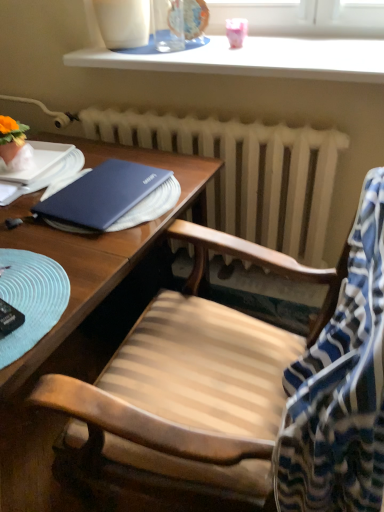
Find the location of a particular element. This screenshot has height=512, width=384. wooden chair at center is located at coordinates (246, 394).

Locate an element on the screen. The image size is (384, 512). white matte radiator at center is located at coordinates (245, 173).

Where is `matte blue notebook at center`? The width and height of the screenshot is (384, 512). matte blue notebook at center is located at coordinates (112, 197).

What do you see at coordinates (83, 318) in the screenshot? The height and width of the screenshot is (512, 384). I see `wooden desk at center` at bounding box center [83, 318].

Image resolution: width=384 pixels, height=512 pixels. Identify the location of wooden chair at center. tap(246, 394).

Which object is further away from the camera taking this photo, wooden desk at center or blue striped fabric at right?

wooden desk at center is further away from the camera.

Is wooden desk at center outside of blue striped fabric at right?

wooden desk at center lies outside blue striped fabric at right's area.

Considering the relative sizes of wooden desk at center and blue striped fabric at right in the image provided, is wooden desk at center shorter than blue striped fabric at right?

No, wooden desk at center is not shorter than blue striped fabric at right.

From a real-world perspective, which is physically below, wooden desk at center or blue striped fabric at right?

From a 3D spatial view, wooden desk at center is below.

Considering the sizes of white glossy window sill at upper center and wooden desk at center in the image, is white glossy window sill at upper center wider or thinner than wooden desk at center?

Considering their sizes, white glossy window sill at upper center looks slimmer than wooden desk at center.

This screenshot has height=512, width=384. Find the location of `window sill that appears above the wooden desk at center (from the image's perspective)`. window sill that appears above the wooden desk at center (from the image's perspective) is located at coordinates (255, 58).

Is white glossy window sill at upper center located outside wooden desk at center?

Yes.

Which object is closer to the camera taking this photo, white glossy window sill at upper center or wooden desk at center?

wooden desk at center is more forward.

From the image's perspective, is wooden chair at center above or below matte blue notebook at center?

Based on their image positions, wooden chair at center is located beneath matte blue notebook at center.

Between point (183, 335) and point (86, 218), which one is positioned behind?

The point (183, 335) is farther.

Considering the relative sizes of wooden chair at center and matte blue notebook at center in the image provided, is wooden chair at center shorter than matte blue notebook at center?

In fact, wooden chair at center may be taller than matte blue notebook at center.

In the scene shown: Is wooden chair at center behind matte blue notebook at center?

No, it is in front of matte blue notebook at center.

Are white matte radiator at center and wooden desk at center located far from each other?

No.

Consider the image. Based on their sizes in the image, would you say white matte radiator at center is bigger or smaller than wooden desk at center?

white matte radiator at center is smaller than wooden desk at center.

Which object is wider, white matte radiator at center or wooden desk at center?

wooden desk at center is wider.

From a real-world perspective, is white matte radiator at center physically located above or below wooden desk at center?

Clearly, from a real-world perspective, white matte radiator at center is above wooden desk at center.

Is matte blue notebook at center at the right side of white matte radiator at center?

Incorrect, matte blue notebook at center is not on the right side of white matte radiator at center.

Is matte blue notebook at center in contact with white matte radiator at center?

No, matte blue notebook at center is not next to white matte radiator at center.

From a real-world perspective, is wooden desk at center physically located above or below matte blue notebook at center?

From a real-world perspective, wooden desk at center is physically below matte blue notebook at center.

Which of these two, wooden desk at center or matte blue notebook at center, is smaller?

matte blue notebook at center.

Is point (167, 160) farther from viewer compared to point (175, 186)?

Yes.

Between wooden desk at center and matte blue notebook at center, which one is positioned behind?

Positioned behind is matte blue notebook at center.

Is white matte radiator at center wider than white glossy window sill at upper center?

No.

Consider the image. Are white matte radiator at center and white glossy window sill at upper center making contact?

No, white matte radiator at center is not touching white glossy window sill at upper center.

Is point (130, 112) closer to viewer compared to point (313, 44)?

No, it is behind (313, 44).

At what (x,y) coordinates should I click in order to perform the action: click on blanket below the wooden desk at center (from the image's perspective). Please return your answer as a coordinate pair (x, y). This screenshot has height=512, width=384. Looking at the image, I should click on (340, 387).

Find the location of `desk below the white glossy window sill at upper center (from a real-world perspective)`. desk below the white glossy window sill at upper center (from a real-world perspective) is located at coordinates (83, 318).

Estimate the real-world distances between objects in this image. Which object is further from white matte radiator at center, wooden chair at center or white glossy window sill at upper center?

Based on the image, wooden chair at center appears to be further to white matte radiator at center.

When comparing their distances from wooden desk at center, does wooden chair at center or white glossy window sill at upper center seem closer?

The object closer to wooden desk at center is wooden chair at center.

Estimate the real-world distances between objects in this image. Which object is further from white matte radiator at center, white glossy window sill at upper center or blue striped fabric at right?

blue striped fabric at right lies further to white matte radiator at center than the other object.

From the image, which object appears to be farther from wooden desk at center, white matte radiator at center or matte blue notebook at center?

The object further to wooden desk at center is white matte radiator at center.

Based on their spatial positions, is white matte radiator at center or wooden chair at center further from blue striped fabric at right?

white matte radiator at center is further to blue striped fabric at right.

Estimate the real-world distances between objects in this image. Which object is closer to white matte radiator at center, blue striped fabric at right or wooden desk at center?

wooden desk at center.

Looking at this image, based on their spatial positions, is wooden chair at center or wooden desk at center closer to white matte radiator at center?

wooden desk at center.

Based on their spatial positions, is wooden desk at center or wooden chair at center closer to blue striped fabric at right?

Based on the image, wooden chair at center appears to be nearer to blue striped fabric at right.

Locate an element on the screen. Image resolution: width=384 pixels, height=512 pixels. chair between wooden desk at center and blue striped fabric at right from left to right is located at coordinates (246, 394).

At what (x,y) coordinates should I click in order to perform the action: click on notebook positioned between wooden chair at center and white matte radiator at center from near to far. Please return your answer as a coordinate pair (x, y). Image resolution: width=384 pixels, height=512 pixels. Looking at the image, I should click on (112, 197).

The width and height of the screenshot is (384, 512). I want to click on notebook between white glossy window sill at upper center and wooden chair at center in the up-down direction, so click(112, 197).

At what (x,y) coordinates should I click in order to perform the action: click on notebook between white glossy window sill at upper center and blue striped fabric at right from top to bottom. Please return your answer as a coordinate pair (x, y). This screenshot has width=384, height=512. Looking at the image, I should click on 112,197.